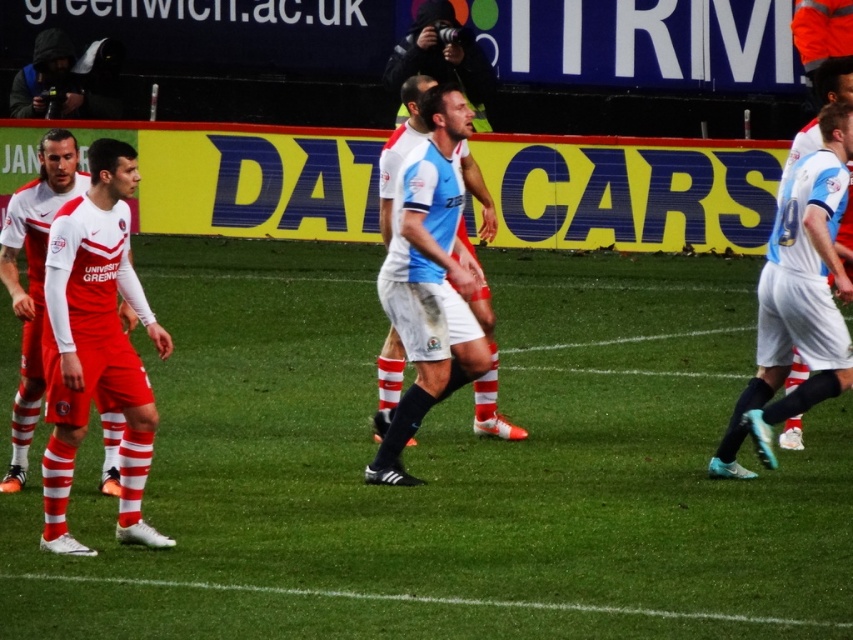
Question: Which point is farther to the camera?

Choices:
 (A) light blue jersey at center
 (B) white matte soccer player at center

Answer: (B)

Question: Is matte red uniform at left above white matte soccer player at center?

Choices:
 (A) no
 (B) yes

Answer: (A)

Question: Which point appears farthest from the camera in this image?

Choices:
 (A) (480, 202)
 (B) (125, 397)

Answer: (A)

Question: Estimate the real-world distances between objects in this image. Which object is farther from the matte red uniform at left?

Choices:
 (A) light blue jersey at center
 (B) white matte soccer player at center

Answer: (A)

Question: Does light blue jersey at center appear over white matte soccer player at center?

Choices:
 (A) yes
 (B) no

Answer: (B)

Question: Can you confirm if matte red uniform at left is thinner than white matte soccer player at center?

Choices:
 (A) no
 (B) yes

Answer: (A)